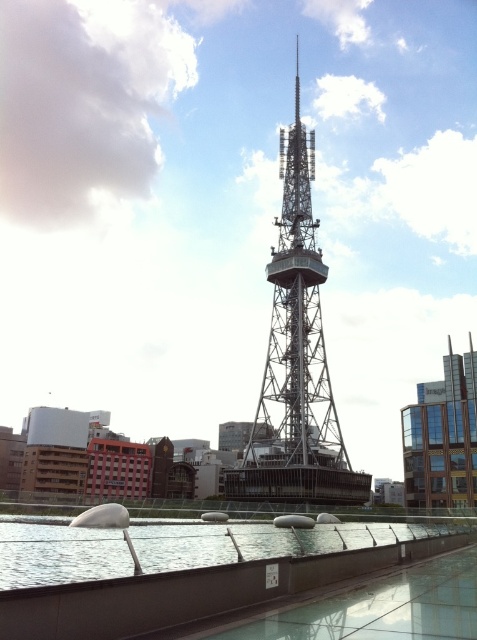
Between metallic lattice tower at center and clear glass water at lower center, which one appears on the left side from the viewer's perspective?

clear glass water at lower center is more to the left.

Which is in front, point (302, 445) or point (111, 560)?

Point (302, 445) is more forward.

Identify the location of metallic lattice tower at center. This screenshot has height=640, width=477. (296, 358).